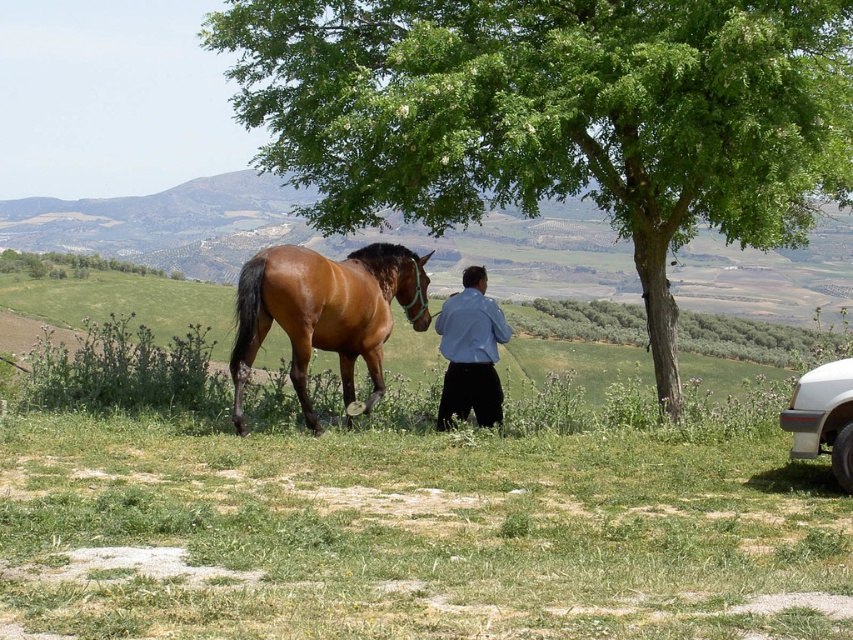
Between point (345, 301) and point (466, 298), which one is positioned in front?

Point (345, 301) is in front.

Locate an element on the screen. Image resolution: width=853 pixels, height=640 pixels. brown glossy horse at center is located at coordinates (325, 314).

Who is higher up, green leafy tree at center or brown glossy horse at center?

Positioned higher is green leafy tree at center.

This screenshot has width=853, height=640. Describe the element at coordinates (556, 115) in the screenshot. I see `green leafy tree at center` at that location.

The image size is (853, 640). What are the coordinates of `green leafy tree at center` in the screenshot? It's located at (556, 115).

Which is above, blue smooth shirt at center or green leafy tree at upper left?

green leafy tree at upper left

Is blue smooth shirt at center shorter than green leafy tree at upper left?

No, blue smooth shirt at center is not shorter than green leafy tree at upper left.

This screenshot has height=640, width=853. What are the coordinates of `blue smooth shirt at center` in the screenshot? It's located at (469, 353).